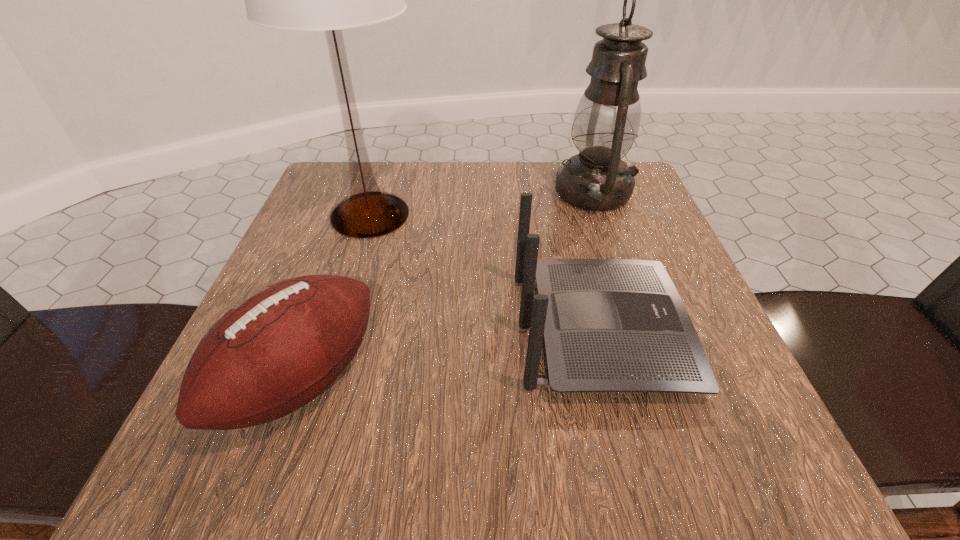
Where is `vacant space that satisfies the following two spatial constraints: 1. on the front-facing side of the second tallest object; 2. on the right side of the router`? The height and width of the screenshot is (540, 960). vacant space that satisfies the following two spatial constraints: 1. on the front-facing side of the second tallest object; 2. on the right side of the router is located at coordinates (564, 192).

The image size is (960, 540). What are the coordinates of `vacant area in the image that satisfies the following two spatial constraints: 1. on the back side of the football (American); 2. on the left side of the oil lamp` in the screenshot? It's located at (367, 192).

Locate an element on the screen. free space that satisfies the following two spatial constraints: 1. above the cylindrical shade of the tallest object; 2. on the front-facing side of the router is located at coordinates (334, 331).

Where is `blank space that satisfies the following two spatial constraints: 1. above the cylindrical shade of the tallest object; 2. on the front-facing side of the router`? blank space that satisfies the following two spatial constraints: 1. above the cylindrical shade of the tallest object; 2. on the front-facing side of the router is located at coordinates (334, 331).

This screenshot has height=540, width=960. I want to click on blank space that satisfies the following two spatial constraints: 1. on the front-facing side of the second tallest object; 2. on the left side of the router, so click(564, 192).